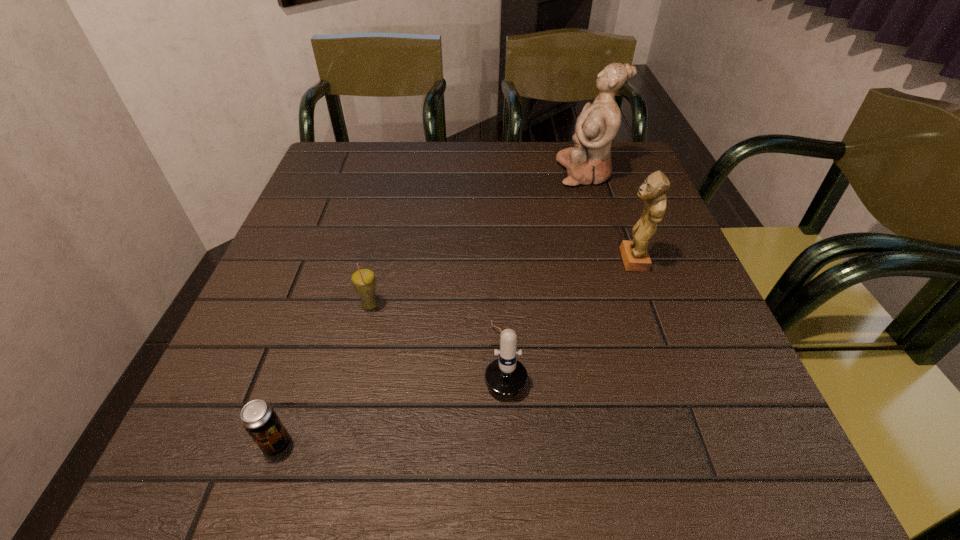
Where is `the tallest object`? This screenshot has width=960, height=540. the tallest object is located at coordinates (589, 161).

Locate an element on the screen. This screenshot has height=540, width=960. the taller figurine is located at coordinates (589, 161).

Identify the location of the shorter figurine. (635, 256).

At what (x,y) coordinates should I click in order to perform the action: click on the second tallest object. Please return your answer as a coordinate pair (x, y). The image size is (960, 540). Looking at the image, I should click on (635, 256).

This screenshot has height=540, width=960. I want to click on straw for drinking, so click(363, 279).

Where is `the third nearest object`? This screenshot has width=960, height=540. the third nearest object is located at coordinates (363, 279).

Find the location of a particular element. The image size is (960, 540). the fourth farthest object is located at coordinates (506, 377).

In order to click on the third object from left to right in this screenshot , I will do `click(506, 377)`.

Find the location of a particular element. Image resolution: width=960 pixels, height=540 pixels. the leftmost object is located at coordinates (259, 419).

I want to click on the shortest object, so click(259, 419).